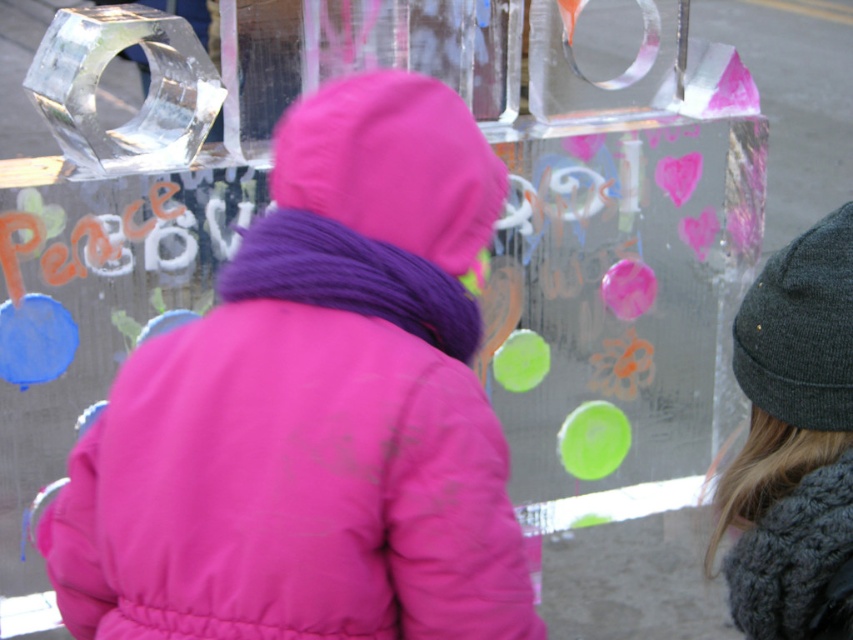
Question: Which point is closer to the camera?

Choices:
 (A) pink matte jacket at center
 (B) knitted gray beanie at right

Answer: (B)

Question: Observing the image, what is the correct spatial positioning of pink matte jacket at center in reference to knitted gray beanie at right?

Choices:
 (A) above
 (B) below

Answer: (A)

Question: Which point is farther to the camera?

Choices:
 (A) pink matte jacket at center
 (B) knitted gray beanie at right

Answer: (A)

Question: Is pink matte jacket at center further to the viewer compared to knitted gray beanie at right?

Choices:
 (A) no
 (B) yes

Answer: (B)

Question: Which point is farther from the camera taking this photo?

Choices:
 (A) (834, 420)
 (B) (409, 378)

Answer: (B)

Question: In this image, where is pink matte jacket at center located relative to knitted gray beanie at right?

Choices:
 (A) above
 (B) below

Answer: (A)